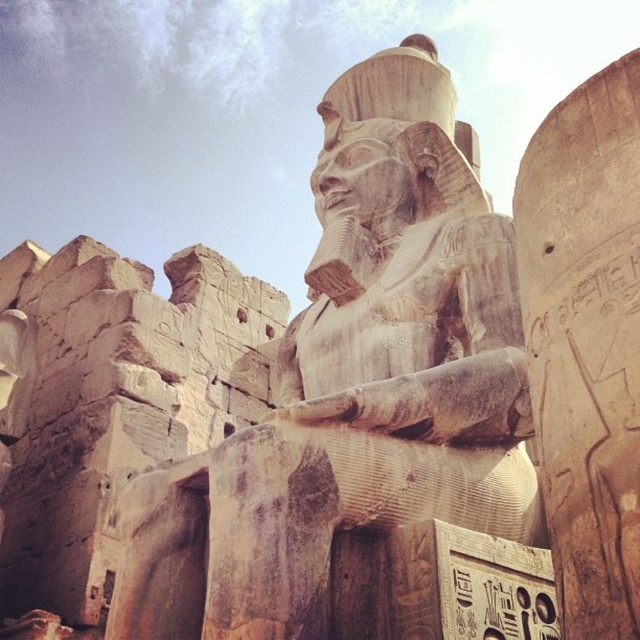
Between carved stone statue at center and smooth stone hieroglyphics at right, which one is positioned higher?

carved stone statue at center is above.

Which is in front, point (307, 307) or point (637, 467)?

Point (637, 467) is in front.

Measure the distance between carved stone statue at center and camera.

carved stone statue at center is 42.05 meters away from camera.

I want to click on carved stone statue at center, so click(x=355, y=387).